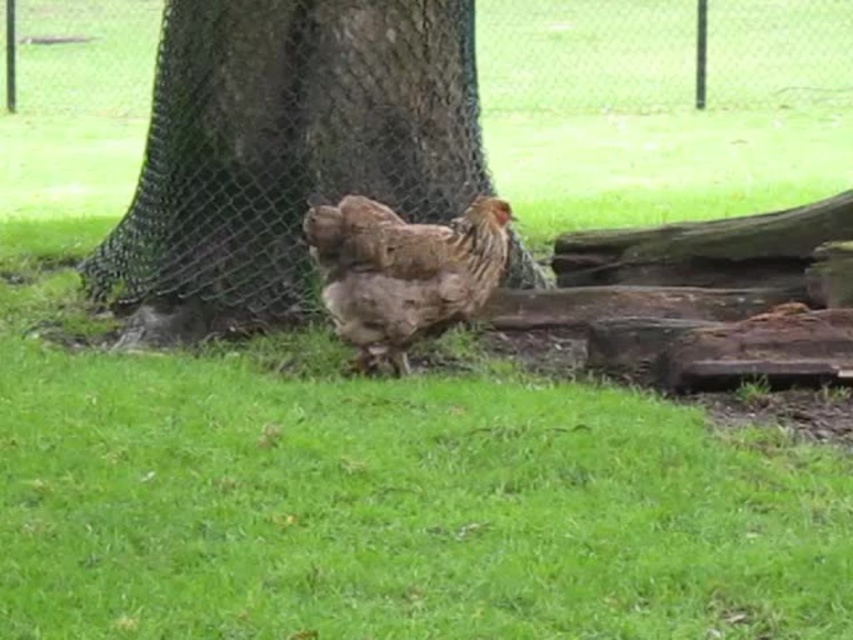
Question: Is brown textured tree trunk at center wider than brown feathered chicken at center?

Choices:
 (A) no
 (B) yes

Answer: (B)

Question: Which object is closer to the camera taking this photo?

Choices:
 (A) brown textured tree trunk at center
 (B) brown feathered chicken at center

Answer: (B)

Question: Which of the following is the farthest from the observer?

Choices:
 (A) brown feathered chicken at center
 (B) brown textured tree trunk at center

Answer: (B)

Question: Which object appears farthest from the camera in this image?

Choices:
 (A) brown feathered chicken at center
 (B) brown textured tree trunk at center

Answer: (B)

Question: Is brown textured tree trunk at center bigger than brown feathered chicken at center?

Choices:
 (A) yes
 (B) no

Answer: (A)

Question: Does brown textured tree trunk at center appear over brown feathered chicken at center?

Choices:
 (A) yes
 (B) no

Answer: (A)